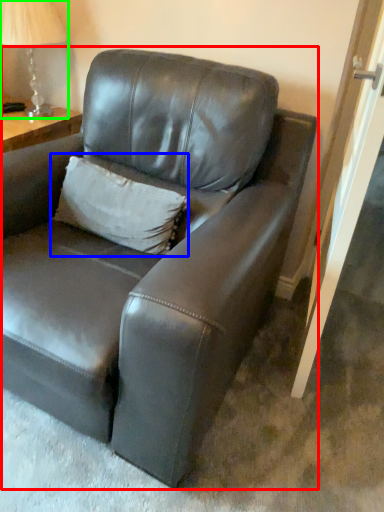
Question: Based on their relative distances, which object is farther from studio couch (highlighted by a red box)? Choose from pillow (highlighted by a blue box) and table lamp (highlighted by a green box).

Choices:
 (A) pillow
 (B) table lamp

Answer: (B)